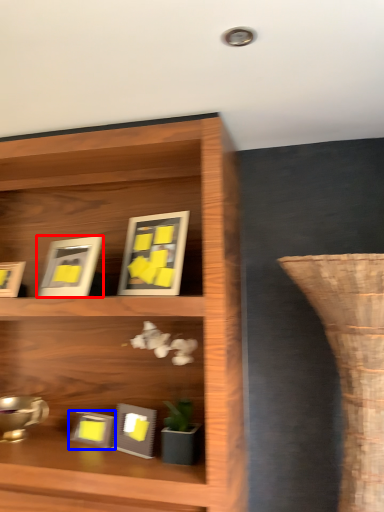
Question: Which object is closer to the camera taking this photo, picture frame (highlighted by a red box) or picture frame (highlighted by a blue box)?

Choices:
 (A) picture frame
 (B) picture frame

Answer: (A)